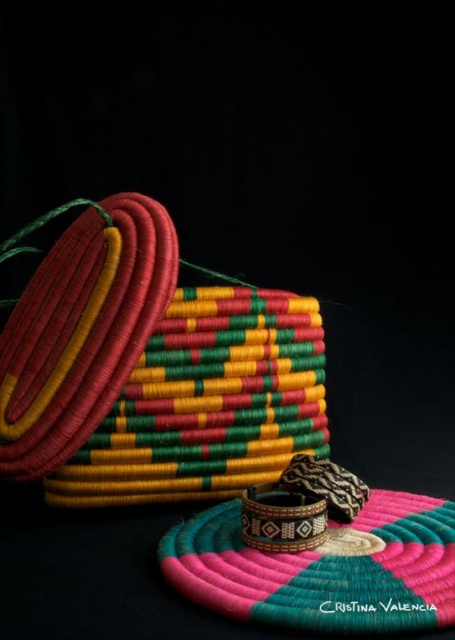
Between textured woven bracelet at left and brown woven bracelet at center, which one is positioned higher?

Positioned higher is textured woven bracelet at left.

Is textured woven bracelet at left to the left of brown woven bracelet at center from the viewer's perspective?

Yes, textured woven bracelet at left is to the left of brown woven bracelet at center.

Which is in front, point (131, 241) or point (308, 545)?

Positioned in front is point (308, 545).

Where is `textured woven bracelet at left`? This screenshot has width=455, height=640. textured woven bracelet at left is located at coordinates (81, 330).

Who is positioned more to the left, brown woven bracelet at center or leather-like brown bracelet at center?

From the viewer's perspective, brown woven bracelet at center appears more on the left side.

Is brown woven bracelet at center wider than leather-like brown bracelet at center?

Incorrect, brown woven bracelet at center's width does not surpass leather-like brown bracelet at center's.

The height and width of the screenshot is (640, 455). Identify the location of brown woven bracelet at center. (282, 518).

Image resolution: width=455 pixels, height=640 pixels. Identify the location of brown woven bracelet at center. (282, 518).

Is bright multicolored woven basket at center positioned before textured woven bracelet at left?

No, it is behind textured woven bracelet at left.

Is bright multicolored woven basket at center wider than textured woven bracelet at left?

Correct, the width of bright multicolored woven basket at center exceeds that of textured woven bracelet at left.

Which is behind, point (236, 452) or point (82, 440)?

The point (236, 452) is behind.

The height and width of the screenshot is (640, 455). Find the location of `bright multicolored woven basket at center`. bright multicolored woven basket at center is located at coordinates (207, 403).